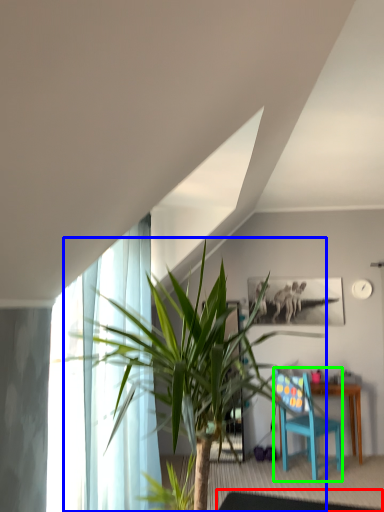
Question: Which is nearer to the glass table (highlighted by a red box)? houseplant (highlighted by a blue box) or chair (highlighted by a green box).

Choices:
 (A) houseplant
 (B) chair

Answer: (B)